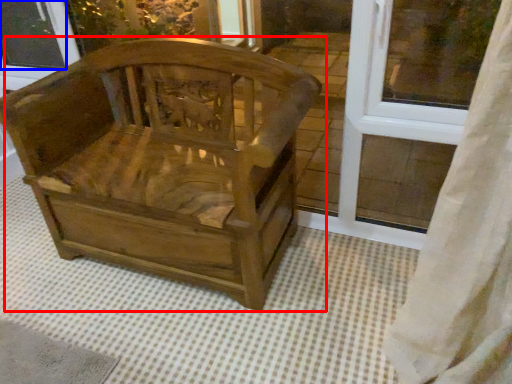
Question: Which object appears farthest to the camera in this image, chair (highlighted by a red box) or window screen (highlighted by a blue box)?

Choices:
 (A) chair
 (B) window screen

Answer: (B)